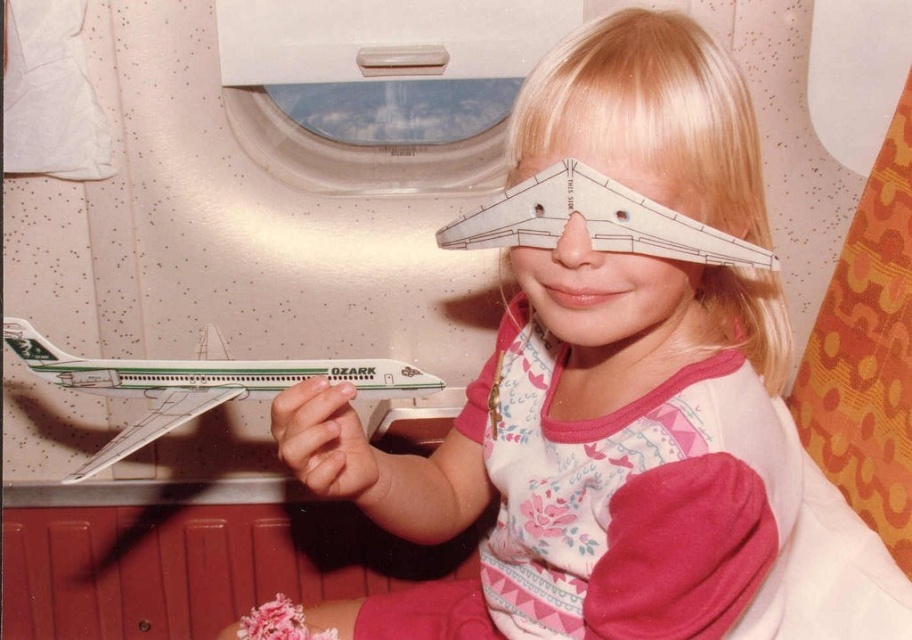
You are a flight attendant on an airplane. You see a child wearing a pink fabric shirt at center and holding a green and white paper airplane at left. Which item takes up more space in the image?

The pink fabric shirt at center is larger in size than the green and white paper airplane at left, so the pink fabric shirt at center takes up more space in the image.

You are sitting in an airplane seat and see the transparent plastic airplane window at upper center and the green and white paper airplane at left. Which object is located higher in the image?

The transparent plastic airplane window at upper center is positioned over the green and white paper airplane at left, so it is higher.